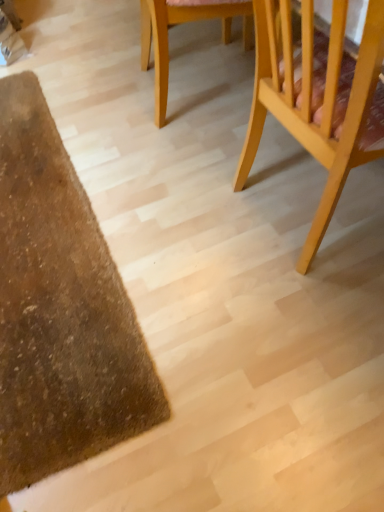
This screenshot has width=384, height=512. What do you see at coordinates (181, 23) in the screenshot?
I see `light wood chair at upper center, marked as the 2th chair in a right-to-left arrangement` at bounding box center [181, 23].

Identify the location of light wood chair at upper center, marked as the 2th chair in a right-to-left arrangement. (181, 23).

What do you see at coordinates (319, 99) in the screenshot?
I see `light wood chair at right, placed as the 2th chair when sorted from left to right` at bounding box center [319, 99].

Locate an element on the screen. This screenshot has height=512, width=384. light wood chair at right, placed as the 2th chair when sorted from left to right is located at coordinates (319, 99).

Identify the location of light wood chair at upper center, the 1th chair when ordered from left to right. The width and height of the screenshot is (384, 512). [181, 23].

Which is more to the left, light wood chair at right, the first chair viewed from the right, or light wood chair at upper center, the 1th chair when ordered from left to right?

Positioned to the left is light wood chair at upper center, the 1th chair when ordered from left to right.

From the picture: Relative to light wood chair at upper center, marked as the 2th chair in a right-to-left arrangement, is light wood chair at right, placed as the 2th chair when sorted from left to right, in front or behind?

light wood chair at right, placed as the 2th chair when sorted from left to right, is positioned closer to the viewer than light wood chair at upper center, marked as the 2th chair in a right-to-left arrangement.

Is point (315, 131) more distant than point (227, 36)?

No.

From the image's perspective, which one is positioned higher, light wood chair at right, placed as the 2th chair when sorted from left to right, or light wood chair at upper center, the 1th chair when ordered from left to right?

light wood chair at upper center, the 1th chair when ordered from left to right.

From a real-world perspective, relative to light wood chair at upper center, marked as the 2th chair in a right-to-left arrangement, is light wood chair at right, the first chair viewed from the right, vertically above or below?

From a real-world perspective, light wood chair at right, the first chair viewed from the right, is physically above light wood chair at upper center, marked as the 2th chair in a right-to-left arrangement.

Which of these two, light wood chair at right, the first chair viewed from the right, or light wood chair at upper center, marked as the 2th chair in a right-to-left arrangement, is thinner?

Thinner between the two is light wood chair at upper center, marked as the 2th chair in a right-to-left arrangement.

Who is taller, light wood chair at right, placed as the 2th chair when sorted from left to right, or light wood chair at upper center, marked as the 2th chair in a right-to-left arrangement?

light wood chair at right, placed as the 2th chair when sorted from left to right.

In the scene shown: Can you confirm if light wood chair at right, the first chair viewed from the right, is bigger than light wood chair at upper center, the 1th chair when ordered from left to right?

Correct, light wood chair at right, the first chair viewed from the right, is larger in size than light wood chair at upper center, the 1th chair when ordered from left to right.

Does light wood chair at right, placed as the 2th chair when sorted from left to right, contain light wood chair at upper center, the 1th chair when ordered from left to right?

No, light wood chair at upper center, the 1th chair when ordered from left to right, is located outside of light wood chair at right, placed as the 2th chair when sorted from left to right.

Are light wood chair at right, the first chair viewed from the right, and light wood chair at upper center, the 1th chair when ordered from left to right, far apart?

That's not correct — light wood chair at right, the first chair viewed from the right, is a little close to light wood chair at upper center, the 1th chair when ordered from left to right.

Is light wood chair at right, the first chair viewed from the right, turned away from light wood chair at upper center, the 1th chair when ordered from left to right?

No.

Locate an element on the screen. chair above the light wood chair at right, the first chair viewed from the right (from the image's perspective) is located at coordinates (181, 23).

In the scene shown: Is light wood chair at upper center, the 1th chair when ordered from left to right, to the left or to the right of light wood chair at right, the first chair viewed from the right, in the image?

light wood chair at upper center, the 1th chair when ordered from left to right, is positioned on light wood chair at right, the first chair viewed from the right,'s left side.

Between light wood chair at upper center, the 1th chair when ordered from left to right, and light wood chair at right, placed as the 2th chair when sorted from left to right, which one is positioned behind?

light wood chair at upper center, the 1th chair when ordered from left to right.

Considering the positions of points (146, 54) and (339, 193), is point (146, 54) farther from camera compared to point (339, 193)?

That is True.

From the image's perspective, is light wood chair at upper center, the 1th chair when ordered from left to right, on top of light wood chair at right, the first chair viewed from the right?

Yes.

From a real-world perspective, between light wood chair at upper center, marked as the 2th chair in a right-to-left arrangement, and light wood chair at right, the first chair viewed from the right, who is vertically lower?

light wood chair at upper center, marked as the 2th chair in a right-to-left arrangement, is physically lower.

Does light wood chair at upper center, the 1th chair when ordered from left to right, have a lesser width compared to light wood chair at right, placed as the 2th chair when sorted from left to right?

Yes.

Does light wood chair at upper center, marked as the 2th chair in a right-to-left arrangement, have a greater height compared to light wood chair at right, the first chair viewed from the right?

No.

Looking at the image, does light wood chair at upper center, marked as the 2th chair in a right-to-left arrangement, seem bigger or smaller compared to light wood chair at right, the first chair viewed from the right?

light wood chair at upper center, marked as the 2th chair in a right-to-left arrangement, is smaller than light wood chair at right, the first chair viewed from the right.

Is light wood chair at upper center, the 1th chair when ordered from left to right, completely or partially outside of light wood chair at right, placed as the 2th chair when sorted from left to right?

Yes, light wood chair at upper center, the 1th chair when ordered from left to right, is outside of light wood chair at right, placed as the 2th chair when sorted from left to right.

Would you consider light wood chair at upper center, the 1th chair when ordered from left to right, to be distant from light wood chair at right, placed as the 2th chair when sorted from left to right?

No.

Is light wood chair at upper center, the 1th chair when ordered from left to right, oriented towards light wood chair at right, placed as the 2th chair when sorted from left to right?

No, light wood chair at upper center, the 1th chair when ordered from left to right, is not oriented towards light wood chair at right, placed as the 2th chair when sorted from left to right.

The height and width of the screenshot is (512, 384). Find the location of `chair lying behind the light wood chair at right, placed as the 2th chair when sorted from left to right`. chair lying behind the light wood chair at right, placed as the 2th chair when sorted from left to right is located at coordinates (181, 23).

Find the location of a particular element. The image size is (384, 512). chair on the right side of light wood chair at upper center, the 1th chair when ordered from left to right is located at coordinates (319, 99).

The image size is (384, 512). What are the coordinates of `chair directly beneath the light wood chair at right, placed as the 2th chair when sorted from left to right (from a real-world perspective)` in the screenshot? It's located at (181, 23).